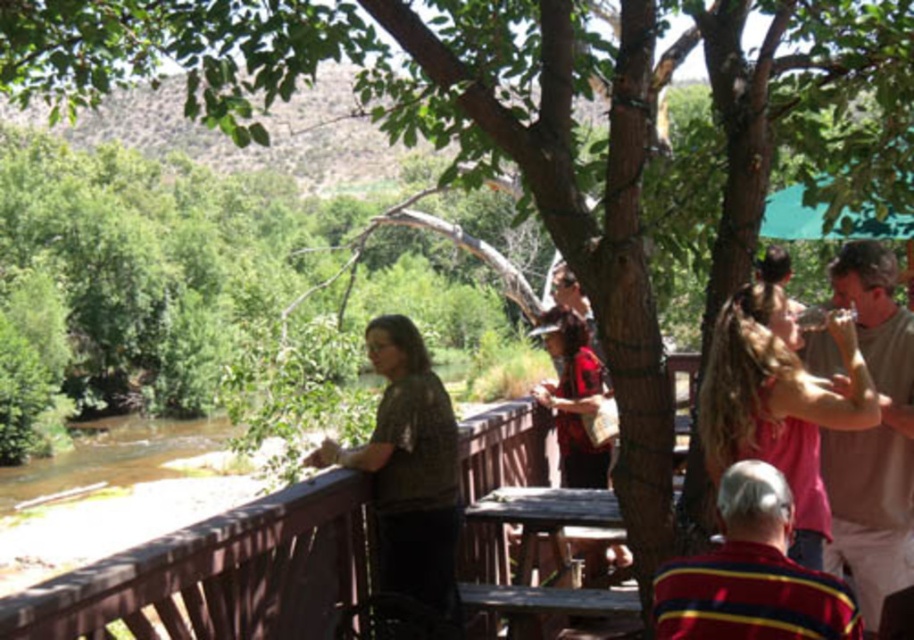
You are standing on the wooden bridge and want to place your backpack on the brown wood rail at left. However, you notice the pink fabric shirt at right nearby. Which object is wider so that your backpack can fit?

The brown wood rail at left might be wider than pink fabric shirt at right, so the backpack can fit on the brown wood rail at left.

You are standing on the wooden bridge and want to take a photo of the point at coordinates point (799, 492). If your camera has a maximum focus range of 4 meters, will you be able to focus on that point?

The distance of point (799, 492) from the camera is 4.29 meters, which exceeds the camera maximum focus range of 4 meters. So you won not be able to focus on that point.